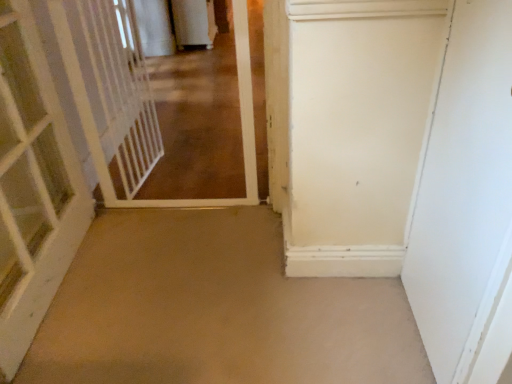
Question: From the image's perspective, is white glossy gate at upper left located beneath white matte door at right, which is counted as the second door, starting from the left?

Choices:
 (A) no
 (B) yes

Answer: (A)

Question: Is white glossy gate at upper left surrounding white matte door at right, which is the first door from right to left?

Choices:
 (A) no
 (B) yes

Answer: (A)

Question: Does white glossy gate at upper left have a greater height compared to white matte door at right, which is counted as the second door, starting from the left?

Choices:
 (A) yes
 (B) no

Answer: (B)

Question: Is white glossy gate at upper left further to camera compared to white matte door at right, which is the first door from right to left?

Choices:
 (A) no
 (B) yes

Answer: (B)

Question: Is white glossy gate at upper left facing towards white matte door at right, which is counted as the second door, starting from the left?

Choices:
 (A) yes
 (B) no

Answer: (B)

Question: Is white glossy gate at upper left next to white matte door at right, which is the first door from right to left, and touching it?

Choices:
 (A) no
 (B) yes

Answer: (A)

Question: Is white wooden door at left, the 2th door viewed from the right, to the right of beige carpet at center from the viewer's perspective?

Choices:
 (A) yes
 (B) no

Answer: (B)

Question: Is white wooden door at left, the 2th door viewed from the right, in front of beige carpet at center?

Choices:
 (A) no
 (B) yes

Answer: (B)

Question: Is white wooden door at left, marked as the first door in a left-to-right arrangement, wider than beige carpet at center?

Choices:
 (A) yes
 (B) no

Answer: (B)

Question: Is white wooden door at left, the 2th door viewed from the right, placed right next to beige carpet at center?

Choices:
 (A) yes
 (B) no

Answer: (B)

Question: Does white wooden door at left, the 2th door viewed from the right, lie behind beige carpet at center?

Choices:
 (A) yes
 (B) no

Answer: (B)

Question: Does white wooden door at left, the 2th door viewed from the right, have a larger size compared to beige carpet at center?

Choices:
 (A) yes
 (B) no

Answer: (A)

Question: Is white plastic gate at left inside white matte door at right, which is counted as the second door, starting from the left?

Choices:
 (A) no
 (B) yes

Answer: (A)